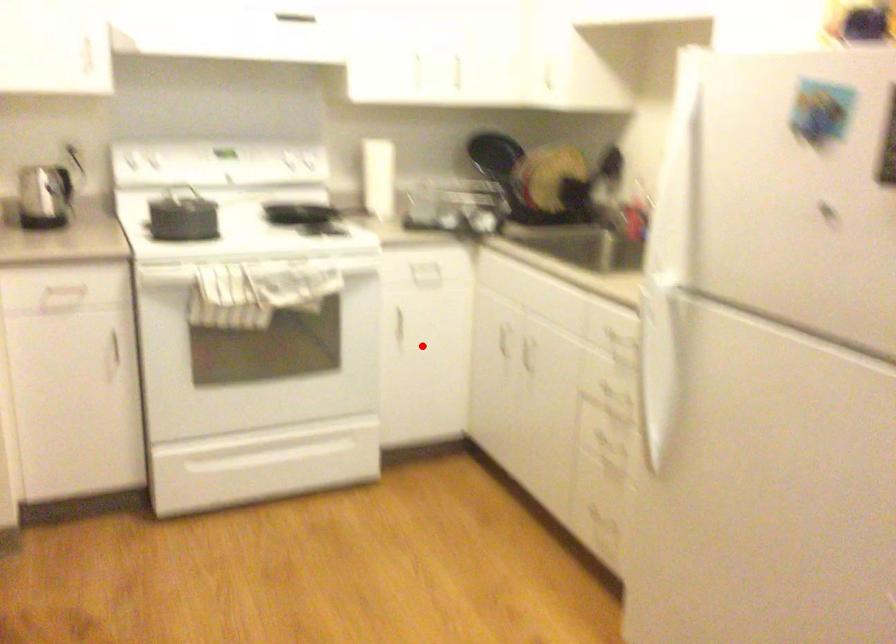
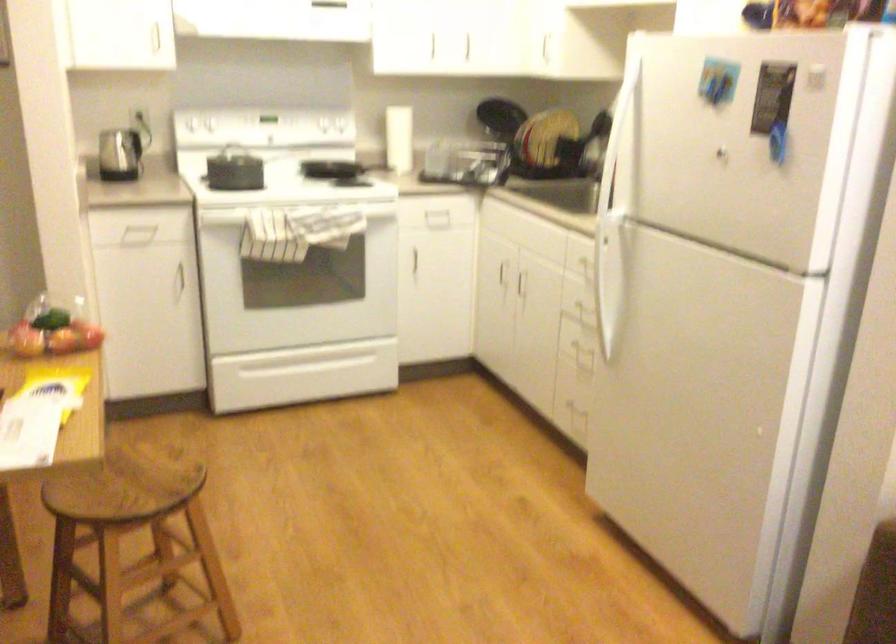
Question: I am providing you with two images of the same scene from different viewpoints. In image1, a red point is highlighted. Considering the same 3D point in image2, which of the following is correct?

Choices:
 (A) It is closer
 (B) It is farther

Answer: (B)